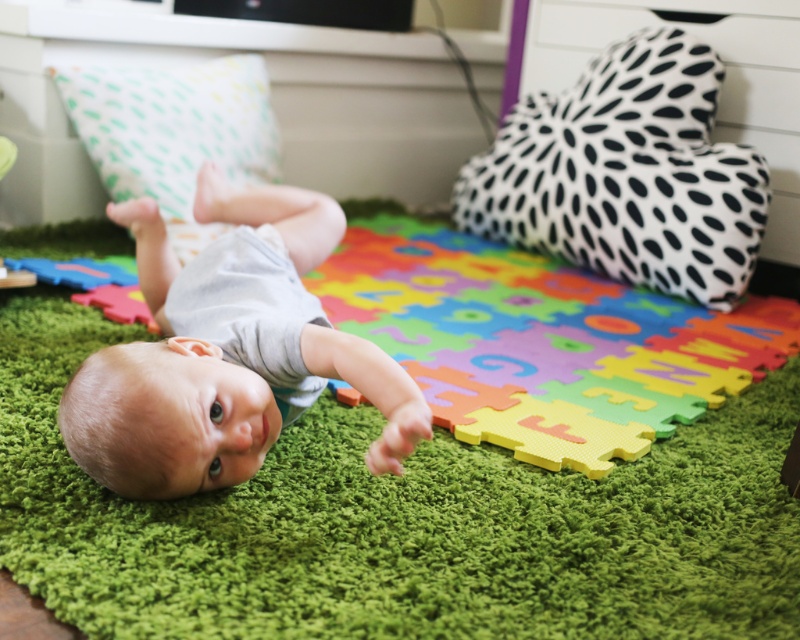
Question: Which of the following is the farthest from the observer?

Choices:
 (A) rubberized foam puzzle piece at lower left
 (B) smooth gray baby at center
 (C) green foam puzzle mat at center

Answer: (A)

Question: Can you confirm if green foam puzzle mat at center is positioned to the left of smooth gray baby at center?

Choices:
 (A) yes
 (B) no

Answer: (B)

Question: Which object is positioned closest to the rubberized foam puzzle piece at lower left?

Choices:
 (A) green foam puzzle mat at center
 (B) smooth gray baby at center

Answer: (A)

Question: Is green foam puzzle mat at center to the right of smooth gray baby at center from the viewer's perspective?

Choices:
 (A) no
 (B) yes

Answer: (B)

Question: Which of the following is the closest to the observer?

Choices:
 (A) rubberized foam puzzle piece at lower left
 (B) smooth gray baby at center

Answer: (B)

Question: Is smooth gray baby at center smaller than rubberized foam puzzle piece at lower left?

Choices:
 (A) yes
 (B) no

Answer: (B)